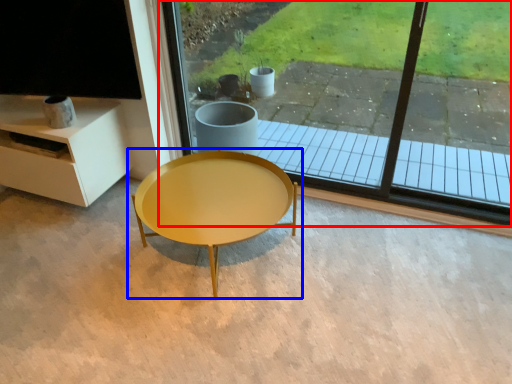
Question: Which object appears closest to the camera in this image, window (highlighted by a red box) or coffee table (highlighted by a blue box)?

Choices:
 (A) window
 (B) coffee table

Answer: (B)